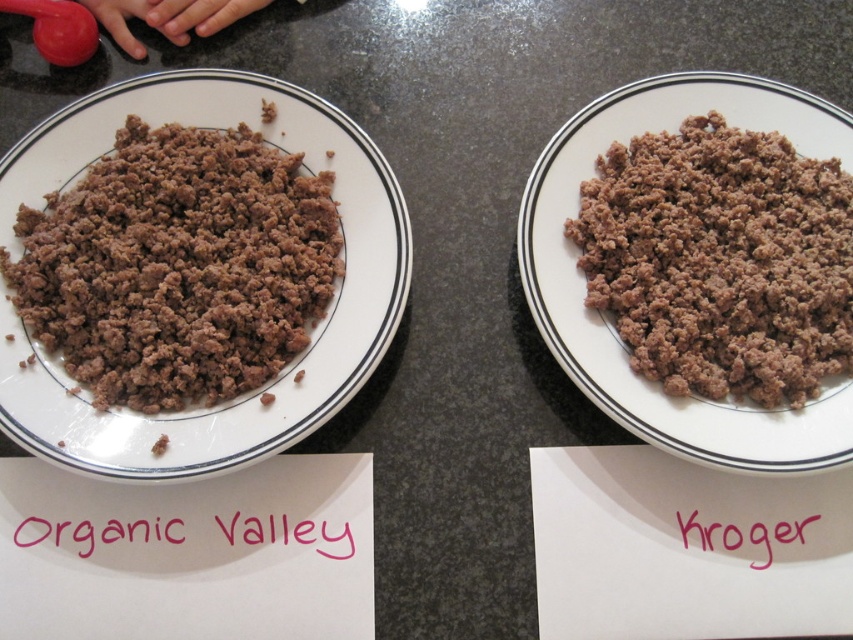
You are taking a photo of the two plates labeled Organic Valley and Kroger. Which of the two points, point 1 at coordinates (x=47, y=536) or point 2 at (x=688, y=538), would appear larger in your photo?

Point 1 at coordinates (x=47, y=536) is closer to the camera than point 2 at (x=688, y=538), so it would appear larger in the photo.

You are a food critic comparing two samples of ground beef. You have to determine which sample has a larger width. The samples are labeled with their brands, one is brown crumbly ground beef at center and the other is pink paper at upper center. Based on the provided scene, which one has a greater width?

The pink paper at upper center has a greater width than the brown crumbly ground beef at center.